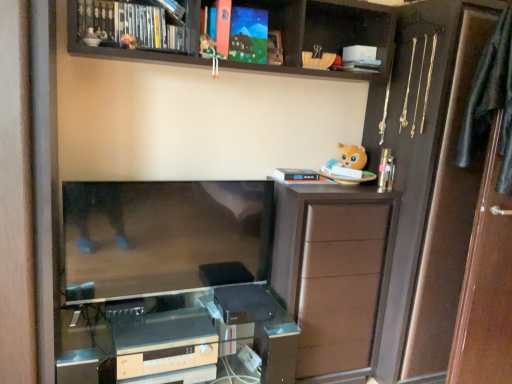
This screenshot has height=384, width=512. Identify the location of free space in front of white matte book at upper center, arranged as the 5th book when viewed from the top. (315, 188).